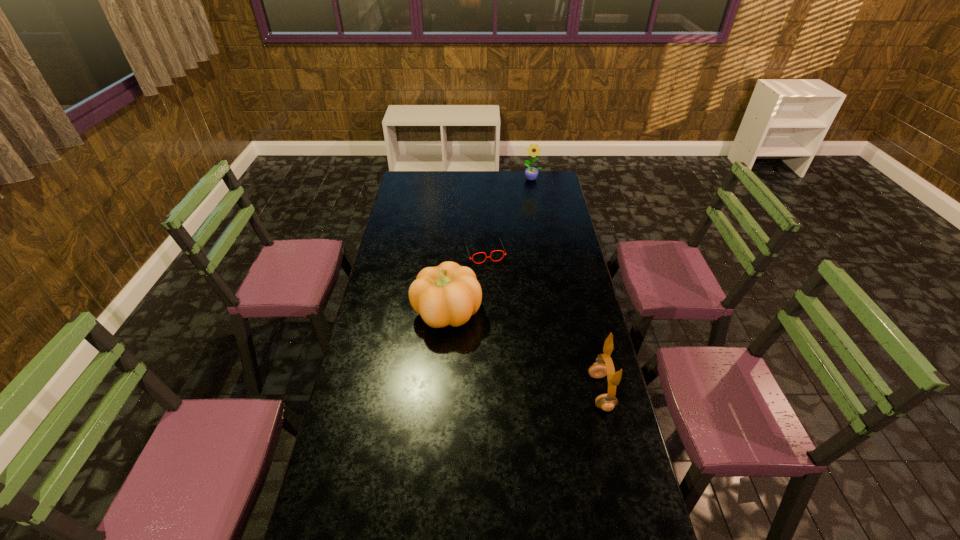
In the image, there is a desktop. Where is `vacant space at the left edge`? This screenshot has height=540, width=960. vacant space at the left edge is located at coordinates (404, 235).

The height and width of the screenshot is (540, 960). In the image, there is a desktop. In order to click on vacant space at the right edge in this screenshot , I will do `click(574, 273)`.

In order to click on free region at the far left corner of the desktop in this screenshot , I will do `click(402, 178)`.

Find the location of `blank space at the far right corner of the desktop`. blank space at the far right corner of the desktop is located at coordinates (543, 181).

Where is `vacant space in between the shortest object and the farthest object`? The height and width of the screenshot is (540, 960). vacant space in between the shortest object and the farthest object is located at coordinates (509, 215).

Identify the location of free spot between the rightmost object and the pumpkin. Image resolution: width=960 pixels, height=540 pixels. point(524,352).

Where is `free space between the second nearest object and the earphone`? This screenshot has height=540, width=960. free space between the second nearest object and the earphone is located at coordinates (524, 352).

The height and width of the screenshot is (540, 960). I want to click on free space between the rightmost object and the second nearest object, so click(524, 352).

Image resolution: width=960 pixels, height=540 pixels. What are the coordinates of `vacant space that's between the second farthest object and the nearest object` in the screenshot? It's located at (542, 322).

Image resolution: width=960 pixels, height=540 pixels. I want to click on empty location between the rightmost object and the second farthest object, so click(x=542, y=322).